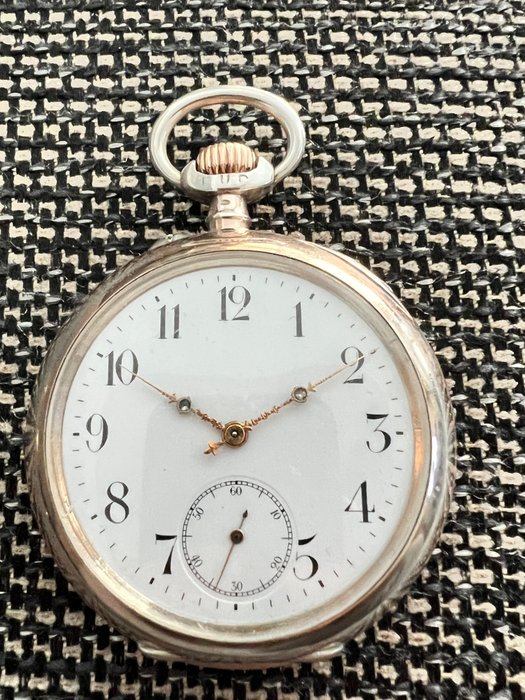
Identify the location of clasp on the clock. Image resolution: width=525 pixels, height=700 pixels. (283, 105).